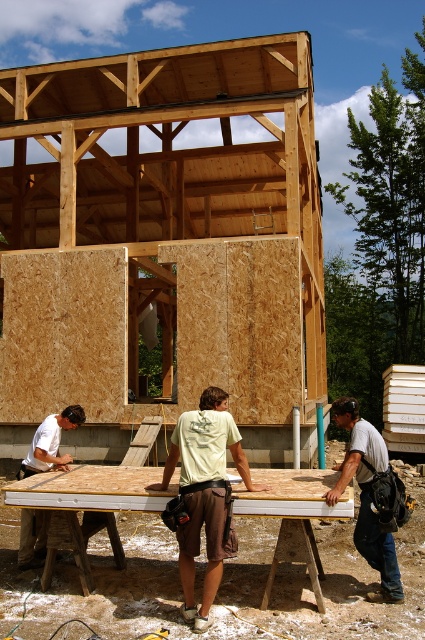
Question: Does white matte shirt at center appear over white shirt at right?

Choices:
 (A) no
 (B) yes

Answer: (A)

Question: Which of the following is the farthest from the observer?

Choices:
 (A) white matte shirt at center
 (B) white shirt at right

Answer: (B)

Question: Is white matte shirt at center closer to the viewer compared to white shirt at right?

Choices:
 (A) yes
 (B) no

Answer: (A)

Question: Among these objects, which one is nearest to the camera?

Choices:
 (A) white shirt at right
 (B) white matte shirt at center

Answer: (B)

Question: Observing the image, what is the correct spatial positioning of white matte shirt at center in reference to white shirt at right?

Choices:
 (A) right
 (B) left

Answer: (B)